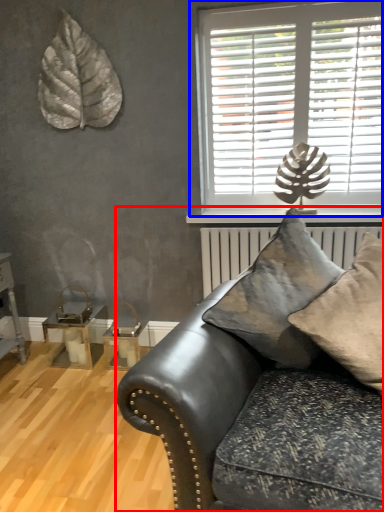
Question: Which object is further to the camera taking this photo, studio couch (highlighted by a red box) or window (highlighted by a blue box)?

Choices:
 (A) studio couch
 (B) window

Answer: (B)